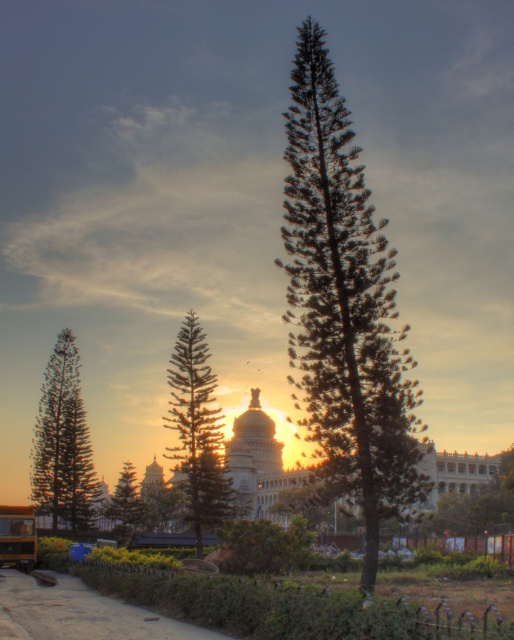
Question: Does green needle-like tree at center lie behind green textured pine tree at lower left?

Choices:
 (A) no
 (B) yes

Answer: (A)

Question: Does green needle-like tree at center have a greater width compared to green needle-like tree at left?

Choices:
 (A) no
 (B) yes

Answer: (A)

Question: Which object is the closest to the green needle-like at center?

Choices:
 (A) green textured pine tree at lower left
 (B) yellow matte school bus at lower left

Answer: (B)

Question: Can you confirm if green needle-like tree at center is positioned to the right of green needle-like tree at left?

Choices:
 (A) no
 (B) yes

Answer: (B)

Question: Based on their relative distances, which object is nearer to the green needle-like tree at left?

Choices:
 (A) green needle-like at center
 (B) green needle-like tree at center
 (C) yellow matte school bus at lower left
 (D) green textured pine tree at lower left

Answer: (D)

Question: Estimate the real-world distances between objects in this image. Which object is closer to the green needle-like tree at left?

Choices:
 (A) yellow matte school bus at lower left
 (B) green needle-like at center
 (C) green needle-like tree at center
 (D) green textured pine tree at lower left

Answer: (D)